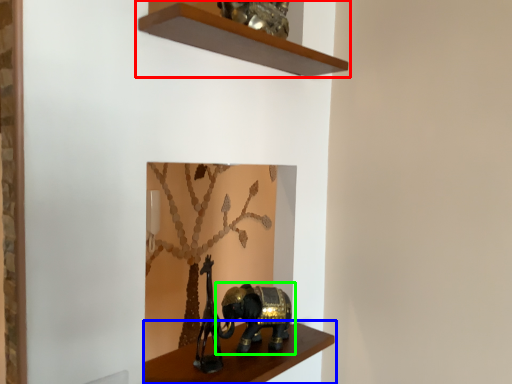
Question: Considering the real-world distances, which object is closest to shelf (highlighted by a red box)? shelf (highlighted by a blue box) or elephant (highlighted by a green box).

Choices:
 (A) shelf
 (B) elephant

Answer: (B)